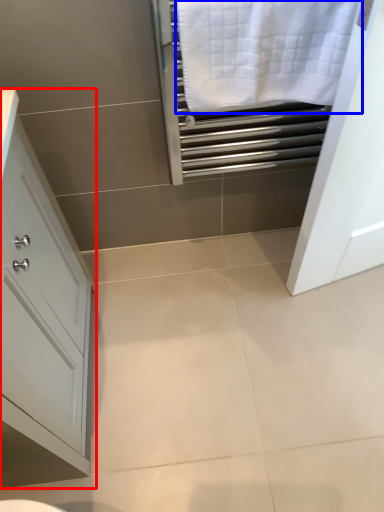
Question: Among these objects, which one is farthest to the camera, bathroom cabinet (highlighted by a red box) or bath towel (highlighted by a blue box)?

Choices:
 (A) bathroom cabinet
 (B) bath towel

Answer: (B)